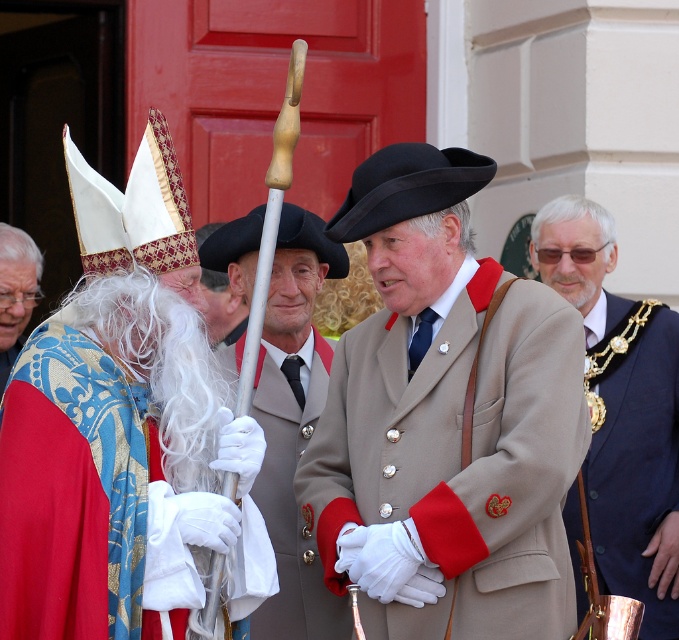
Question: In this image, where is matte beige coat at center located relative to blue velvet robe at left?

Choices:
 (A) below
 (B) above

Answer: (A)

Question: Can you confirm if matte beige coat at center is smaller than gold chain at right?

Choices:
 (A) no
 (B) yes

Answer: (A)

Question: Which object is the closest to the blue velvet robe at left?

Choices:
 (A) matte beige coat at center
 (B) gold chain at right
 (C) silver metallic staff at center

Answer: (C)

Question: Based on their relative distances, which object is farther from the matte beige coat at center?

Choices:
 (A) blue velvet robe at left
 (B) silver metallic staff at center

Answer: (A)

Question: Which object appears closest to the camera in this image?

Choices:
 (A) silver metallic staff at center
 (B) blue velvet robe at left

Answer: (A)

Question: Can you confirm if matte beige coat at center is wider than silver metallic staff at center?

Choices:
 (A) no
 (B) yes

Answer: (B)